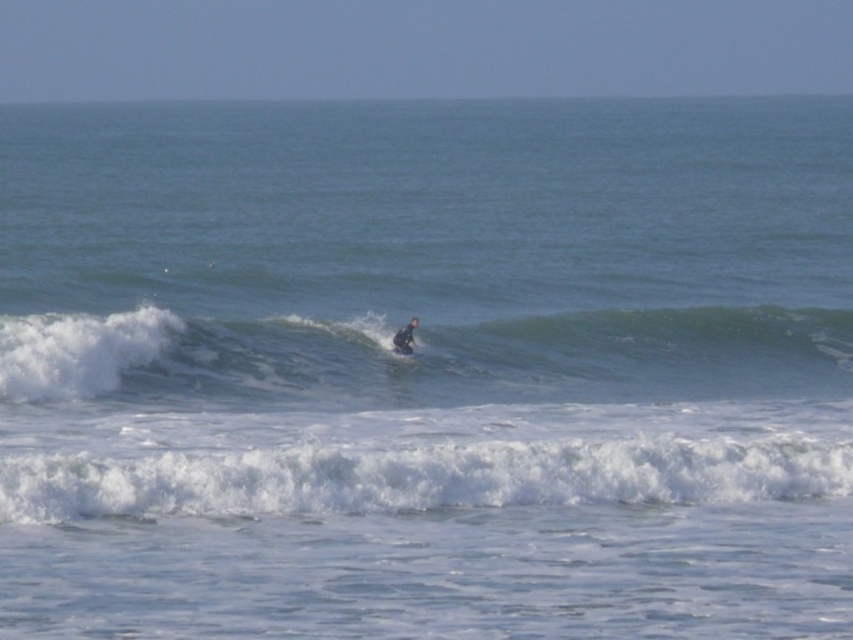
Which of these two, green rubber surfboard at center or blue wetsuit surfer at center, stands shorter?

Standing shorter between the two is blue wetsuit surfer at center.

Is green rubber surfboard at center smaller than blue wetsuit surfer at center?

Actually, green rubber surfboard at center might be larger than blue wetsuit surfer at center.

What do you see at coordinates (424, 358) in the screenshot? The height and width of the screenshot is (640, 853). I see `green rubber surfboard at center` at bounding box center [424, 358].

I want to click on green rubber surfboard at center, so click(424, 358).

Who is shorter, blue wetsuit surfer at center or blue foam surfboard at center?

blue foam surfboard at center is shorter.

Is blue wetsuit surfer at center positioned behind blue foam surfboard at center?

Yes, blue wetsuit surfer at center is behind blue foam surfboard at center.

The width and height of the screenshot is (853, 640). I want to click on blue wetsuit surfer at center, so click(x=404, y=337).

Does green rubber surfboard at center have a lesser width compared to white foamy wave at lower center?

No, green rubber surfboard at center is not thinner than white foamy wave at lower center.

Can you confirm if green rubber surfboard at center is smaller than white foamy wave at lower center?

Actually, green rubber surfboard at center might be larger than white foamy wave at lower center.

Measure the distance between green rubber surfboard at center and camera.

green rubber surfboard at center is 20.18 meters from camera.

The height and width of the screenshot is (640, 853). I want to click on green rubber surfboard at center, so click(x=424, y=358).